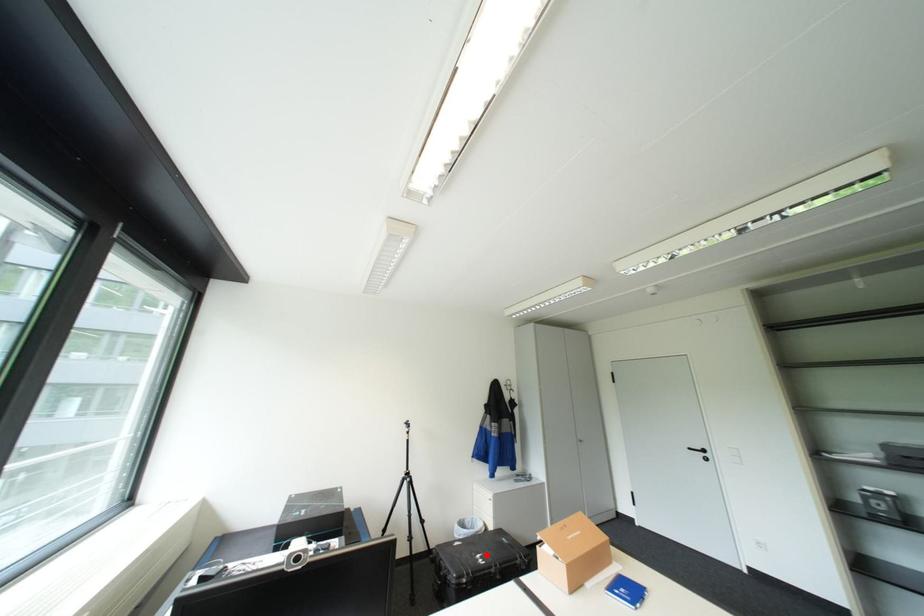
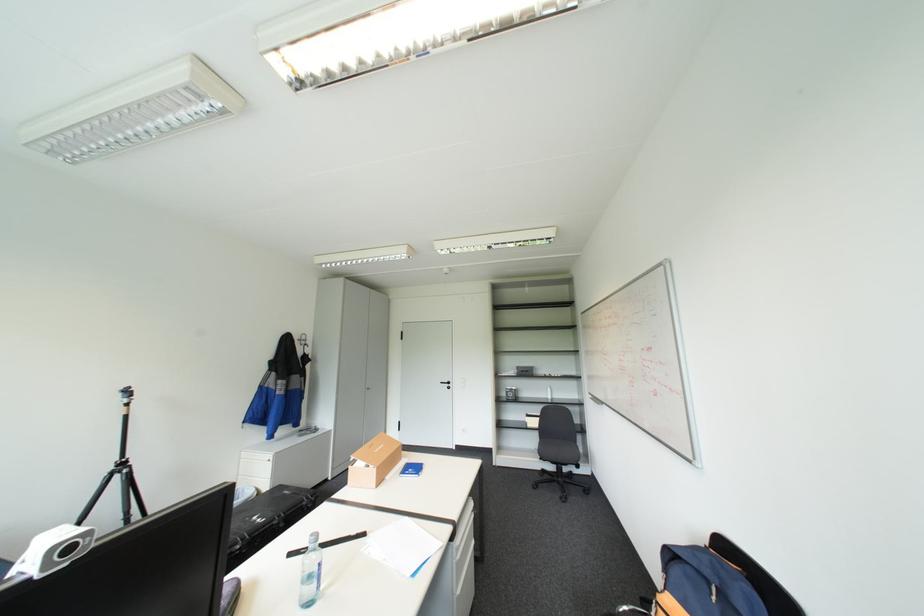
Find the pixel in the second image that matches the highlighted location in the first image.

(262, 517)